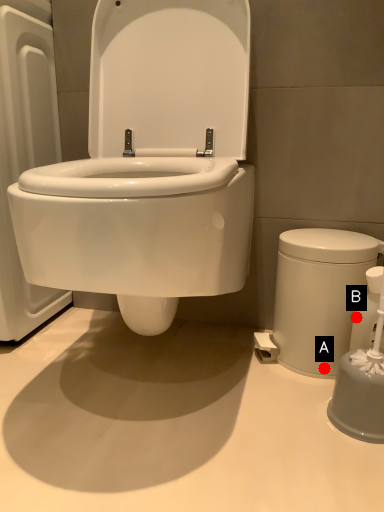
Question: Two points are circled on the image, labeled by A and B beside each circle. Which point is closer to the camera?

Choices:
 (A) A is closer
 (B) B is closer

Answer: (B)